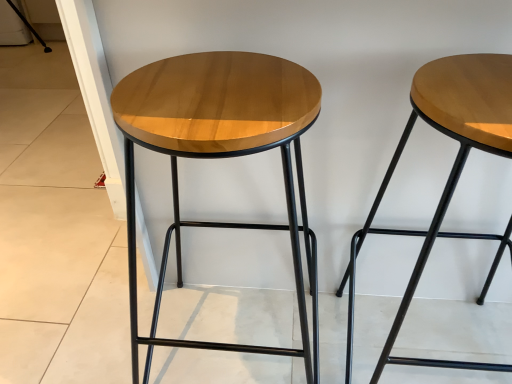
Question: From the image's perspective, relative to wooden stool at upper right, acting as the 2th stool starting from the left, is wooden stool at center, the 2th stool from the right, above or below?

Choices:
 (A) below
 (B) above

Answer: (B)

Question: Is wooden stool at center, arranged as the first stool when viewed from the left, inside the boundaries of wooden stool at upper right, the 1th stool from the right, or outside?

Choices:
 (A) outside
 (B) inside

Answer: (A)

Question: Considering their positions, is wooden stool at center, arranged as the first stool when viewed from the left, located in front of or behind wooden stool at upper right, acting as the 2th stool starting from the left?

Choices:
 (A) behind
 (B) front

Answer: (A)

Question: Would you say wooden stool at upper right, the 1th stool from the right, is to the left or to the right of wooden stool at center, arranged as the first stool when viewed from the left, in the picture?

Choices:
 (A) left
 (B) right

Answer: (B)

Question: Does point (463, 61) appear closer or farther from the camera than point (155, 81)?

Choices:
 (A) farther
 (B) closer

Answer: (A)

Question: Considering the positions of wooden stool at upper right, the 1th stool from the right, and wooden stool at center, the 2th stool from the right, in the image, is wooden stool at upper right, the 1th stool from the right, bigger or smaller than wooden stool at center, the 2th stool from the right,?

Choices:
 (A) big
 (B) small

Answer: (B)

Question: Considering the positions of wooden stool at upper right, acting as the 2th stool starting from the left, and wooden stool at center, the 2th stool from the right, in the image, is wooden stool at upper right, acting as the 2th stool starting from the left, taller or shorter than wooden stool at center, the 2th stool from the right,?

Choices:
 (A) short
 (B) tall

Answer: (A)